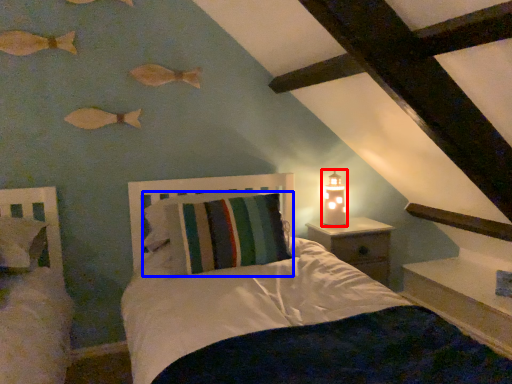
Question: Which point is closer to the camera, candle holder (highlighted by a red box) or pillow (highlighted by a blue box)?

Choices:
 (A) candle holder
 (B) pillow

Answer: (B)